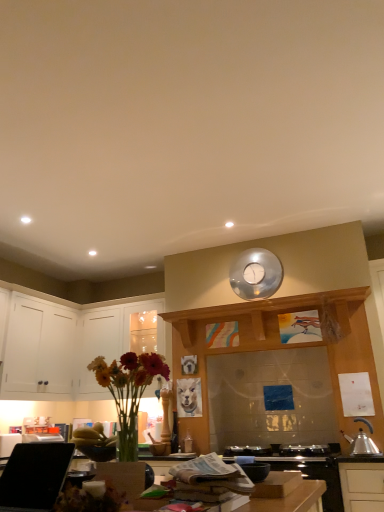
Question: In terms of height, does matte glass vase with flowers at lower left look taller or shorter compared to white matte cabinet at left, acting as the 1th cabinetry starting from the left?

Choices:
 (A) short
 (B) tall

Answer: (A)

Question: Considering their positions, is matte glass vase with flowers at lower left located in front of or behind white matte cabinet at left, acting as the 1th cabinetry starting from the left?

Choices:
 (A) front
 (B) behind

Answer: (A)

Question: Which object is the farthest from the black glass stove at lower center?

Choices:
 (A) metallic silver kettle at lower right
 (B) matte glass vase with flowers at lower left
 (C) metallic silver clock at center
 (D) wooden surface at center
 (E) white glossy cabinets at left, which ranks as the second cabinetry in left-to-right order

Answer: (E)

Question: Estimate the real-world distances between objects in this image. Which object is closer to the wooden surface at center?

Choices:
 (A) metallic silver clock at center
 (B) white glossy cabinets at left, which ranks as the second cabinetry in left-to-right order
 (C) matte glass vase with flowers at lower left
 (D) white matte cabinet at left, the second cabinetry in the right-to-left sequence
 (E) black glass stove at lower center

Answer: (C)